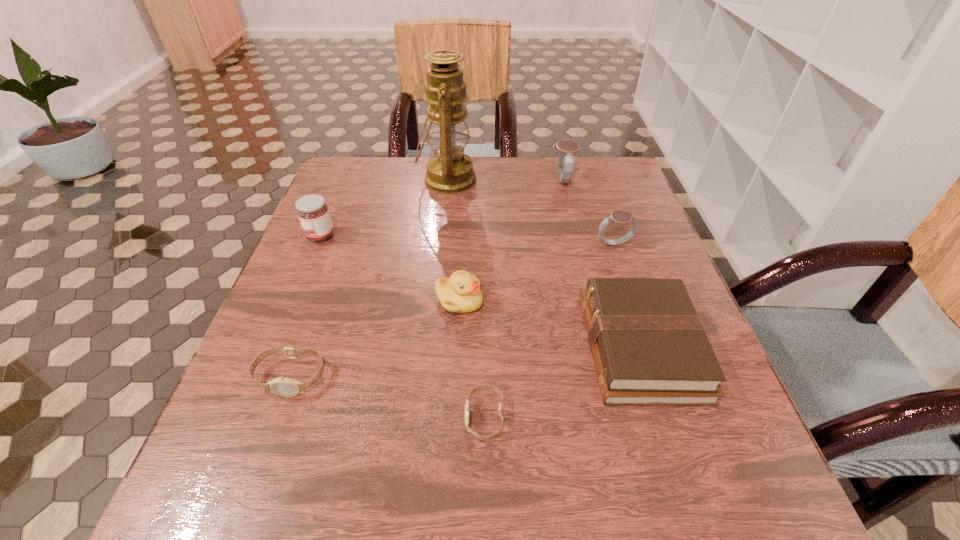
Find the location of a particular element. The height and width of the screenshot is (540, 960). free space located 0.080m on the face of the left beige watch is located at coordinates (267, 444).

Locate an element on the screen. The height and width of the screenshot is (540, 960). vacant area situated on the face of the shortest object is located at coordinates (372, 417).

This screenshot has height=540, width=960. Find the location of `free space located 0.290m on the face of the shortest object`. free space located 0.290m on the face of the shortest object is located at coordinates (285, 417).

Identify the location of free space located on the face of the shortest object. The image size is (960, 540). (260, 417).

The height and width of the screenshot is (540, 960). What are the coordinates of `oil lamp positioned at the far edge` in the screenshot? It's located at (450, 171).

Where is `watch that is at the far edge`? watch that is at the far edge is located at coordinates (567, 148).

Where is `jam that is positioned at the left edge`? jam that is positioned at the left edge is located at coordinates (312, 211).

Locate an element on the screen. This screenshot has height=540, width=960. watch present at the left edge is located at coordinates click(286, 387).

Image resolution: width=960 pixels, height=540 pixels. I want to click on Bible that is positioned at the right edge, so click(649, 346).

At what (x,y) coordinates should I click in order to perform the action: click on object at the far right corner. Please return your answer as a coordinate pair (x, y). The width and height of the screenshot is (960, 540). Looking at the image, I should click on (567, 148).